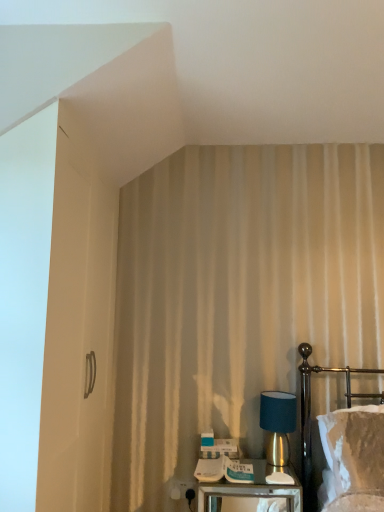
Measure the distance between point (325, 370) and camera.

A distance of 7.49 feet exists between point (325, 370) and camera.

Locate an element on the screen. The image size is (384, 512). teal fabric lampshade at right is located at coordinates (278, 424).

This screenshot has width=384, height=512. I want to click on velvet white bed at right, so click(x=310, y=409).

From the image's perspective, is velvet white bed at right below teal fabric lampshade at right?

No, from the image's perspective, velvet white bed at right is not below teal fabric lampshade at right.

Which is closer, [300,350] or [270,416]?

The point [270,416] is in front.

Considering the relative sizes of velvet white bed at right and teal fabric lampshade at right in the image provided, is velvet white bed at right taller than teal fabric lampshade at right?

Yes.

Is teal fabric lampshade at right surrounded by velvet white bed at right?

Actually, teal fabric lampshade at right is outside velvet white bed at right.

From the picture: Is teal fabric lampshade at right closer to camera compared to white plastic electric outlet at lower center?

Yes, teal fabric lampshade at right is closer to the viewer.

Is point (264, 398) farther from viewer compared to point (174, 485)?

That is False.

From a real-world perspective, relative to white plastic electric outlet at lower center, is teal fabric lampshade at right vertically above or below?

teal fabric lampshade at right is above white plastic electric outlet at lower center.

At what (x,y) coordinates should I click in order to perform the action: click on table lamp that is above the white plastic electric outlet at lower center (from the image's perspective). Please return your answer as a coordinate pair (x, y). Looking at the image, I should click on (278, 424).

Is white plastic electric outlet at lower center in front of teal fabric lampshade at right?

No, the depth of white plastic electric outlet at lower center is greater than that of teal fabric lampshade at right.

Is teal fabric lampshade at right at the back of white plastic electric outlet at lower center?

That's not correct — white plastic electric outlet at lower center is not looking away from teal fabric lampshade at right.

How many degrees apart are the facing directions of velvet white bed at right and metallic silver nightstand at lower center?

0.000724 degrees.

Considering the positions of objects velvet white bed at right and metallic silver nightstand at lower center in the image provided, who is more to the left, velvet white bed at right or metallic silver nightstand at lower center?

Positioned to the left is metallic silver nightstand at lower center.

Is velvet white bed at right not within metallic silver nightstand at lower center?

velvet white bed at right lies outside metallic silver nightstand at lower center's area.

Is the depth of velvet white bed at right greater than that of metallic silver nightstand at lower center?

No.

Based on the photo, how different are the orientations of white plastic electric outlet at lower center and velvet white bed at right in degrees?

The facing directions of white plastic electric outlet at lower center and velvet white bed at right are 0.00421 degrees apart.

Is point (172, 485) in front of point (303, 372)?

Yes, it is in front of point (303, 372).

Choose the correct answer: Is white plastic electric outlet at lower center inside velvet white bed at right or outside it?

white plastic electric outlet at lower center is located beyond the bounds of velvet white bed at right.

Considering the positions of objects velvet white bed at right and white plastic electric outlet at lower center in the image provided, who is more to the left, velvet white bed at right or white plastic electric outlet at lower center?

white plastic electric outlet at lower center.

From a real-world perspective, who is located higher, velvet white bed at right or white plastic electric outlet at lower center?

In real-world perspective, velvet white bed at right is above.

Considering the points (304, 393) and (188, 496), which point is behind, point (304, 393) or point (188, 496)?

The point (304, 393) is more distant.

Locate an element on the screen. electric outlet below the velvet white bed at right (from the image's perspective) is located at coordinates tap(182, 490).

In the image, is metallic silver nightstand at lower center positioned in front of or behind teal fabric lampshade at right?

In the image, metallic silver nightstand at lower center appears in front of teal fabric lampshade at right.

From the image's perspective, is metallic silver nightstand at lower center on teal fabric lampshade at right?

No, from the image's perspective, metallic silver nightstand at lower center is not on top of teal fabric lampshade at right.

What's the angular difference between metallic silver nightstand at lower center and teal fabric lampshade at right's facing directions?

They differ by 0.000156 degrees in their facing directions.

Visually, is metallic silver nightstand at lower center positioned to the left or to the right of teal fabric lampshade at right?

Based on their positions, metallic silver nightstand at lower center is located to the left of teal fabric lampshade at right.

You are a GUI agent. You are given a task and a screenshot of the screen. Output one action in this format:
    pyautogui.click(x=<x>, y=<y>)
    Task: Click on the bed in front of the teal fabric lampshade at right
    This screenshot has height=512, width=384.
    Given the screenshot: What is the action you would take?
    pyautogui.click(x=310, y=409)

Find the location of `electric outlet that appears behind the teal fabric lampshade at right`. electric outlet that appears behind the teal fabric lampshade at right is located at coordinates (182, 490).

Estimate the real-world distances between objects in this image. Which object is further from metallic silver nightstand at lower center, velvet white bed at right or white plastic electric outlet at lower center?

Based on the image, white plastic electric outlet at lower center appears to be further to metallic silver nightstand at lower center.

From the image, which object appears to be farther from teal fabric lampshade at right, white plastic electric outlet at lower center or metallic silver nightstand at lower center?

Among the two, white plastic electric outlet at lower center is located further to teal fabric lampshade at right.

Which object lies further to the anchor point white plastic electric outlet at lower center, teal fabric lampshade at right or metallic silver nightstand at lower center?

teal fabric lampshade at right is positioned further to the anchor white plastic electric outlet at lower center.

From the image, which object appears to be nearer to velvet white bed at right, metallic silver nightstand at lower center or white plastic electric outlet at lower center?

metallic silver nightstand at lower center lies closer to velvet white bed at right than the other object.

Looking at this image, estimate the real-world distances between objects in this image. Which object is closer to velvet white bed at right, white plastic electric outlet at lower center or metallic silver nightstand at lower center?

The object closer to velvet white bed at right is metallic silver nightstand at lower center.

Based on the photo, from the image, which object appears to be farther from velvet white bed at right, teal fabric lampshade at right or white plastic electric outlet at lower center?

white plastic electric outlet at lower center lies further to velvet white bed at right than the other object.

Based on the photo, when comparing their distances from teal fabric lampshade at right, does velvet white bed at right or white plastic electric outlet at lower center seem closer?

velvet white bed at right is positioned closer to the anchor teal fabric lampshade at right.

Looking at the image, which one is located further to metallic silver nightstand at lower center, velvet white bed at right or teal fabric lampshade at right?

The object further to metallic silver nightstand at lower center is velvet white bed at right.

I want to click on table lamp located between white plastic electric outlet at lower center and velvet white bed at right in the left-right direction, so click(x=278, y=424).

Identify the location of nightstand between white plastic electric outlet at lower center and teal fabric lampshade at right in the horizontal direction. The height and width of the screenshot is (512, 384). (252, 490).

Where is `table lamp situated between metallic silver nightstand at lower center and velvet white bed at right from left to right`? This screenshot has height=512, width=384. table lamp situated between metallic silver nightstand at lower center and velvet white bed at right from left to right is located at coordinates (278, 424).

This screenshot has height=512, width=384. I want to click on nightstand situated between white plastic electric outlet at lower center and velvet white bed at right from left to right, so point(252,490).